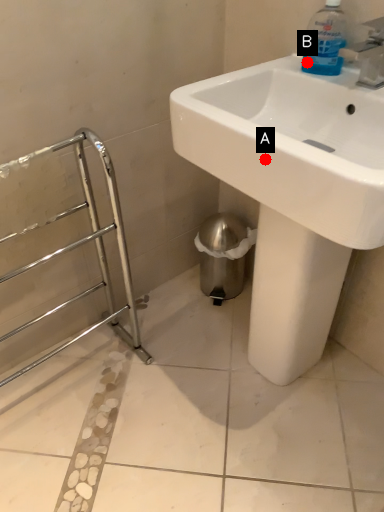
Question: Two points are circled on the image, labeled by A and B beside each circle. Which point is closer to the camera taking this photo?

Choices:
 (A) A is closer
 (B) B is closer

Answer: (A)